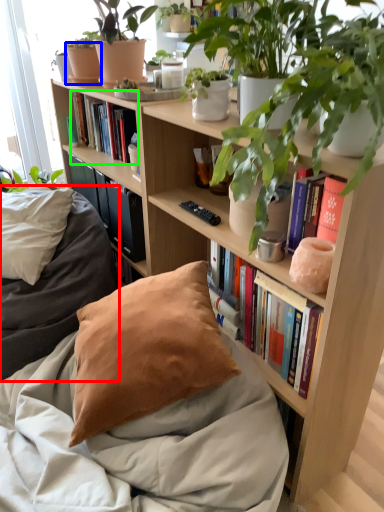
Question: Considering the real-world distances, which object is closest to bedding (highlighted by a red box)? flowerpot (highlighted by a blue box) or book (highlighted by a green box).

Choices:
 (A) flowerpot
 (B) book

Answer: (B)